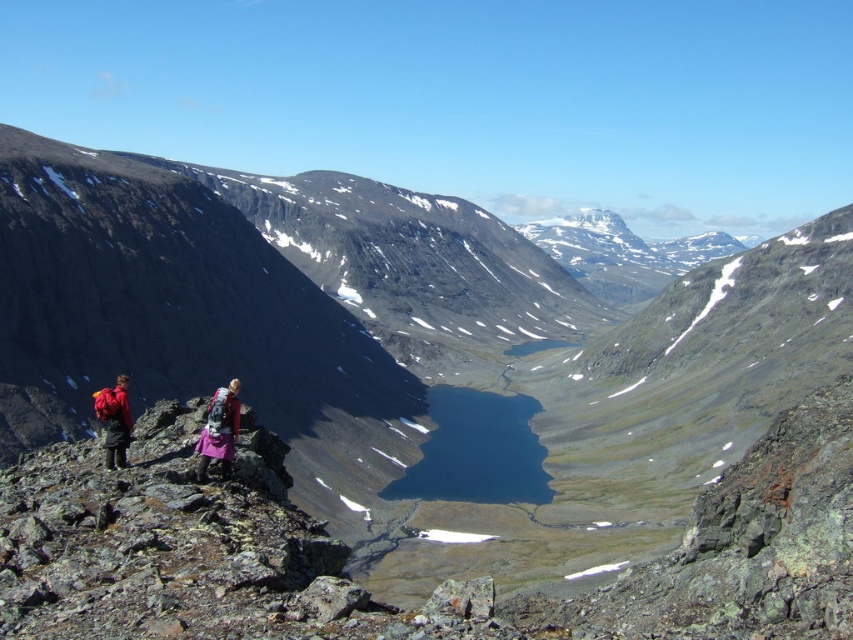
You are a hiker planning to carry both the purple fabric backpack at lower left and the matte red backpack at left. Which backpack has a smaller width?

The purple fabric backpack at lower left has a smaller width than the matte red backpack at left according to the description.

You are a hiker standing at the center of the image and want to place your purple fabric backpack at lower left. Based on the 2D coordinates given, which direction should you move to reach it?

The purple fabric backpack at lower left is located at coordinates point (219,429), so you should move to the lower left direction to reach it.

You are a hiker planning to carry both the purple fabric backpack at lower left and the matte red backpack at left. Which backpack has a greater height?

The purple fabric backpack at lower left is much taller than the matte red backpack at left, so it has a greater height.